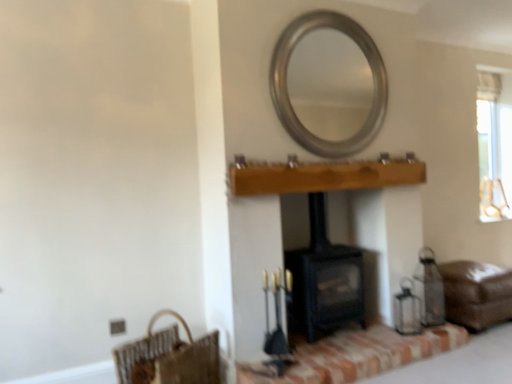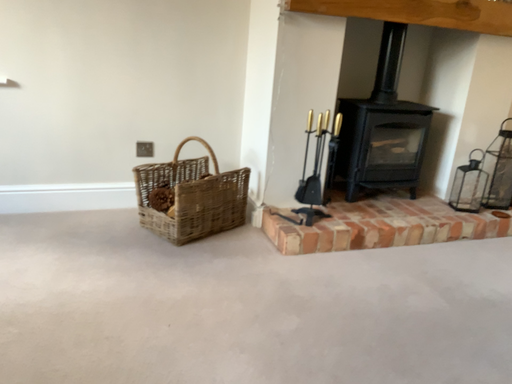
Question: How did the camera likely rotate when shooting the video?

Choices:
 (A) rotated left
 (B) rotated right

Answer: (A)